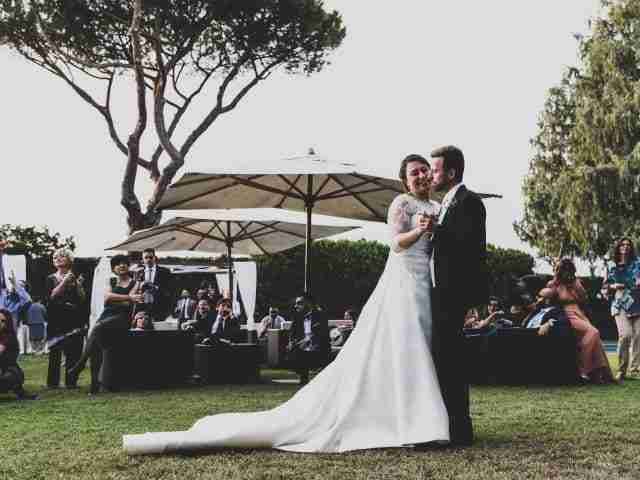
Identify the location of shade covering. The width and height of the screenshot is (640, 480). (339, 173), (249, 243).